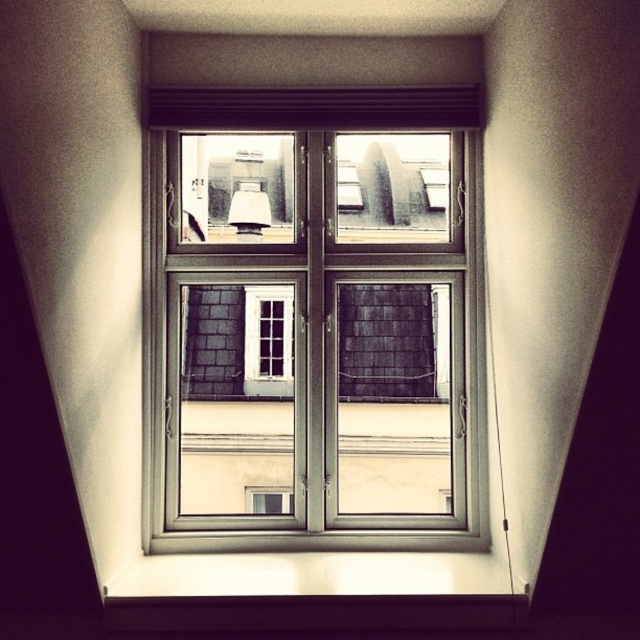
You are standing at point A located at point (260, 385) and need to reach point B, which is 3.08 meters away. Can you estimate how many steps it would take you to walk from point A to point B if each step covers approximately 0.75 meters?

The distance between the two points is 3.08 meters. Dividing this by the step length of 0.75 meters gives approximately 4.1 steps. Since you can only take whole steps, it would take about 5 steps to cover the distance from point A to point B.

You are an interior designer planning to install a new fixture between the metallic silver window at center and the matte white lampshade at upper center. The fixture requires a minimum of 40 centimeters of space. Can the available space accommodate this requirement?

The metallic silver window at center and matte white lampshade at upper center are 43.67 centimeters apart, which exceeds the required 40 centimeters, so the space is sufficient to install the new fixture.

You are an interior designer assessing the lighting in a room. You notice the metallic silver window at center and the matte white lampshade at upper center. Which object is positioned higher in the room?

The matte white lampshade at upper center is positioned higher in the room than the metallic silver window at center.